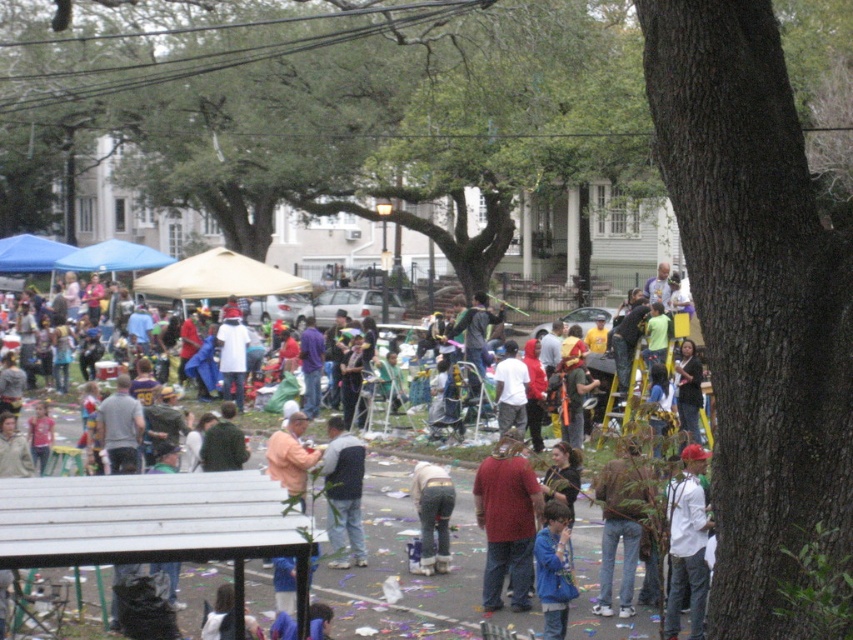
Does matte white shirt at center appear on the right side of gray fabric shirt at center?

Correct, you'll find matte white shirt at center to the right of gray fabric shirt at center.

Can you confirm if matte white shirt at center is smaller than gray fabric shirt at center?

Actually, matte white shirt at center might be larger than gray fabric shirt at center.

This screenshot has width=853, height=640. What are the coordinates of `matte white shirt at center` in the screenshot? It's located at (404, 548).

The image size is (853, 640). Find the location of `brown rough bark tree at right`. brown rough bark tree at right is located at coordinates (759, 314).

Who is positioned more to the right, brown rough bark tree at right or denim pants at center?

Positioned to the right is brown rough bark tree at right.

Describe the element at coordinates (759, 314) in the screenshot. This screenshot has width=853, height=640. I see `brown rough bark tree at right` at that location.

This screenshot has width=853, height=640. Identify the location of brown rough bark tree at right. pos(759,314).

Is blue cotton jacket at lower center above denim pants at center?

Incorrect, blue cotton jacket at lower center is not positioned above denim pants at center.

From the picture: Between blue cotton jacket at lower center and denim pants at center, which one is positioned lower?

Positioned lower is blue cotton jacket at lower center.

The height and width of the screenshot is (640, 853). I want to click on blue cotton jacket at lower center, so click(x=554, y=568).

Where is `blue cotton jacket at lower center`? Image resolution: width=853 pixels, height=640 pixels. blue cotton jacket at lower center is located at coordinates (554, 568).